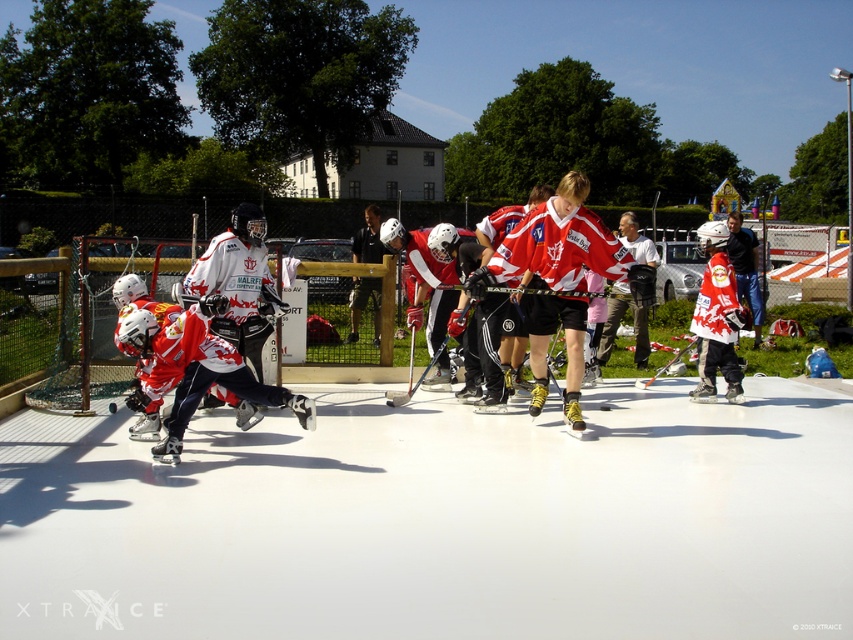
Question: Which point is closer to the camera taking this photo?

Choices:
 (A) (753, 248)
 (B) (392, 403)

Answer: (B)

Question: Which object is the closest to the black glossy hockey stick at center?

Choices:
 (A) white jersey at center
 (B) black leather jacket at center

Answer: (B)

Question: Does black leather jacket at center appear under white jersey at center?

Choices:
 (A) yes
 (B) no

Answer: (B)

Question: Does black leather jacket at center appear over black glossy hockey stick at center?

Choices:
 (A) no
 (B) yes

Answer: (B)

Question: Can you confirm if black leather jacket at center is positioned to the right of white jersey at center?

Choices:
 (A) no
 (B) yes

Answer: (A)

Question: Which of the following is the closest to the observer?

Choices:
 (A) black glossy hockey stick at center
 (B) black leather jacket at center
 (C) white jersey at center

Answer: (A)